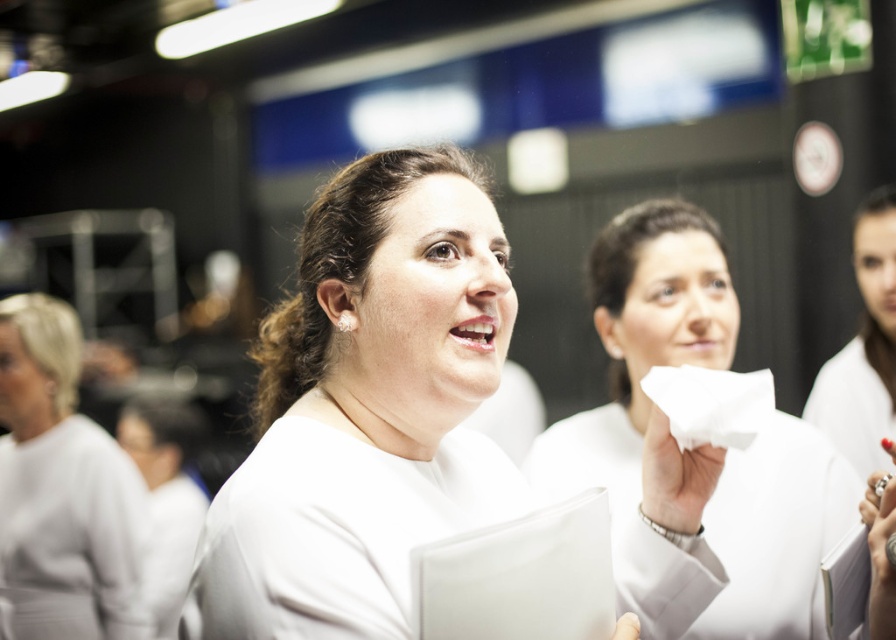
You are organizing a science fair and need to place a white matte paper towel at center and a white matte uniform at upper right. Given their sizes, which object should you place first to ensure they fit properly?

The white matte paper towel at center is bigger than the white matte uniform at upper right, so you should place the white matte paper towel at center first to ensure there is enough space for both items.

You are standing at the entrance of the room and want to reach both the white matte uniform at center and the white matte sweater at center. Which one should you approach first if you want to minimize the distance walked?

The white matte uniform at center is 6.22 feet away from the white matte sweater at center. Since both items are at the center, you would need to approach them simultaneously as they are in the same location. However, if they are positioned differently, you might need to adjust your path accordingly.